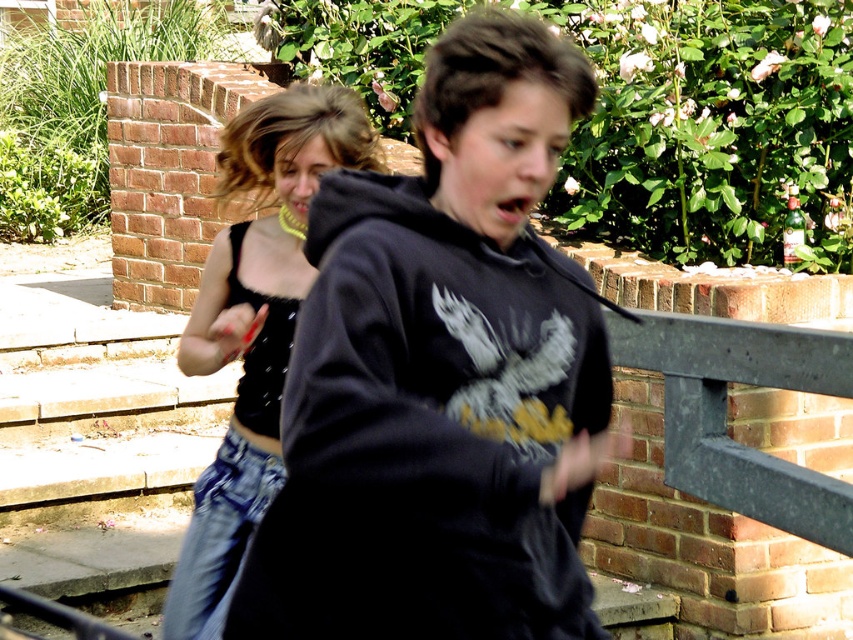
Question: Is black matte hoodie at center wider than denim skirt at left?

Choices:
 (A) no
 (B) yes

Answer: (B)

Question: Can you confirm if black matte hoodie at center is wider than denim skirt at left?

Choices:
 (A) yes
 (B) no

Answer: (A)

Question: Which of the following is the farthest from the observer?

Choices:
 (A) black matte hoodie at center
 (B) denim skirt at left

Answer: (B)

Question: Which of the following is the closest to the observer?

Choices:
 (A) (234, 596)
 (B) (283, 288)

Answer: (A)

Question: Can you confirm if black matte hoodie at center is smaller than denim skirt at left?

Choices:
 (A) yes
 (B) no

Answer: (A)